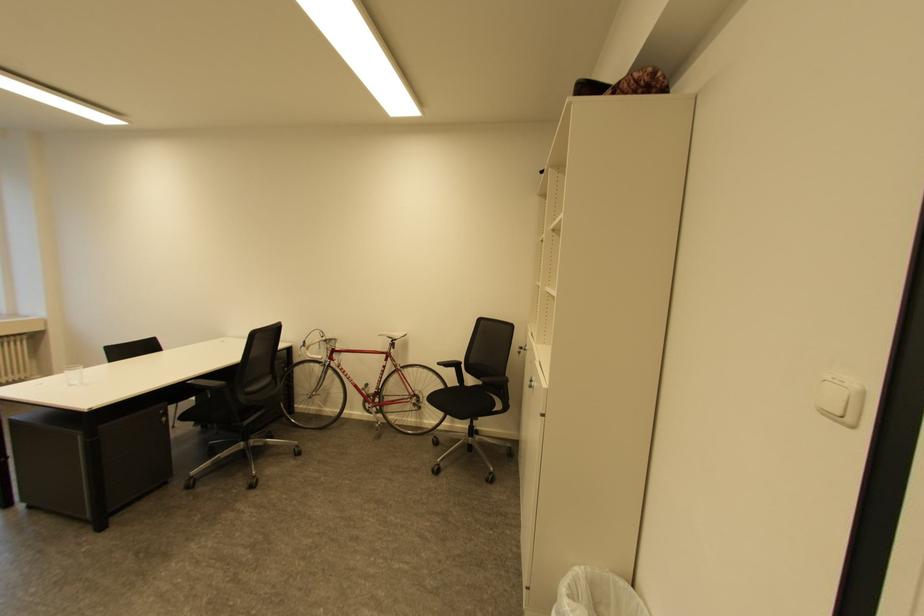
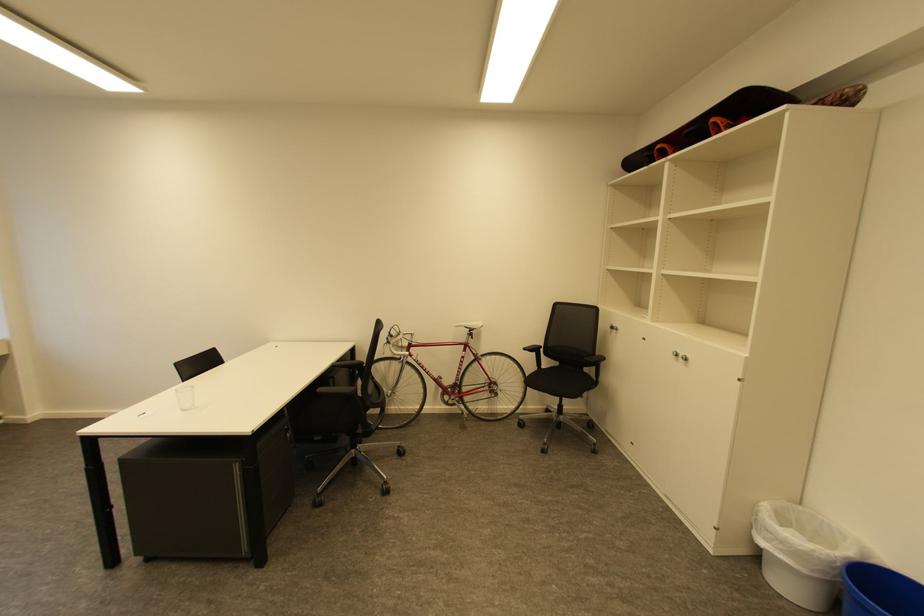
Find the pixel in the second image that matches (445,363) in the first image.

(531, 350)